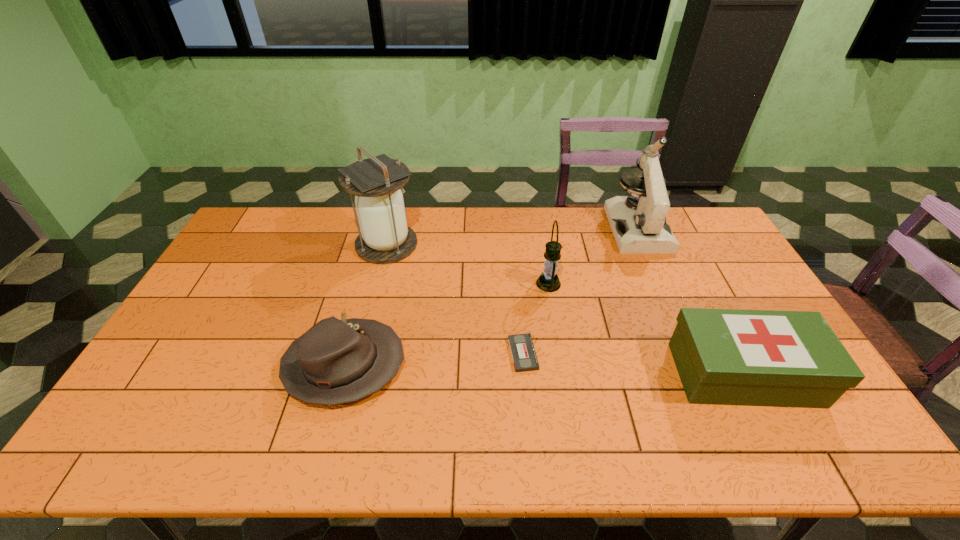
Locate an element on the screen. The height and width of the screenshot is (540, 960). microscope is located at coordinates (638, 222).

Identify the location of the farther lantern. The height and width of the screenshot is (540, 960). (385, 238).

This screenshot has height=540, width=960. In order to click on the taller lantern in this screenshot , I will do `click(385, 238)`.

This screenshot has height=540, width=960. Find the location of `the nearer lantern`. the nearer lantern is located at coordinates (548, 281).

Image resolution: width=960 pixels, height=540 pixels. I want to click on the fourth object from left to right, so click(x=548, y=281).

Find the location of a particular element. the first-aid kit is located at coordinates pyautogui.click(x=723, y=356).

This screenshot has width=960, height=540. I want to click on the second shortest object, so [335, 362].

The image size is (960, 540). In order to click on the shortest object in this screenshot , I will do `click(523, 353)`.

This screenshot has width=960, height=540. In order to click on the third object from left to right in this screenshot , I will do point(523,353).

I want to click on vacant space located at the eyepiece of the microscope, so click(x=656, y=271).